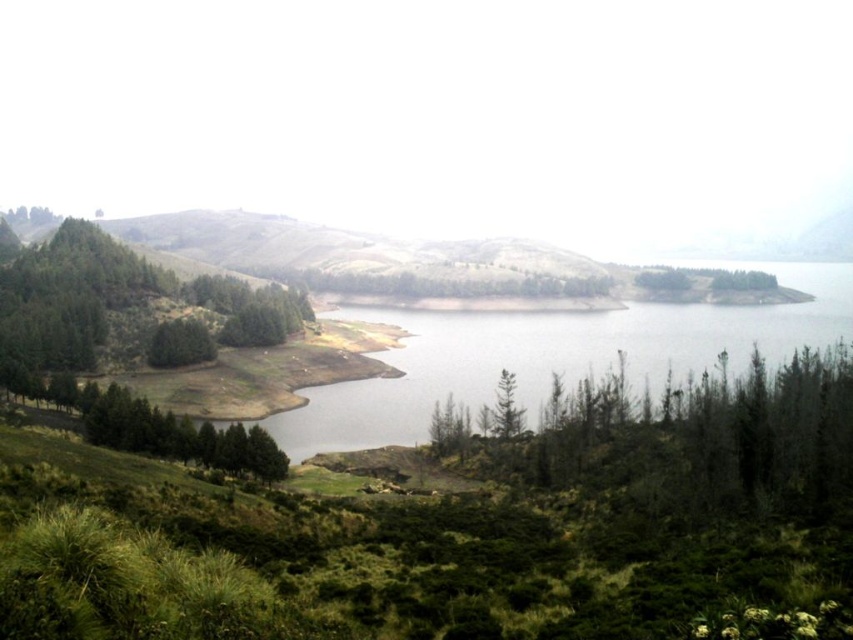
You are planning to place a small wooden bench in the scene. The bench requires a space wider than the green matte tree at lower left. Can the clear water at center provide enough space for the bench?

The clear water at center is wider than the green matte tree at lower left, so yes, the clear water at center can provide enough space for the bench.

You are standing at the edge of the lake and notice the clear water at center and the green matte tree at lower left. Which object is closer to the horizon?

The clear water at center is closer to the horizon than the green matte tree at lower left because it is positioned above it.